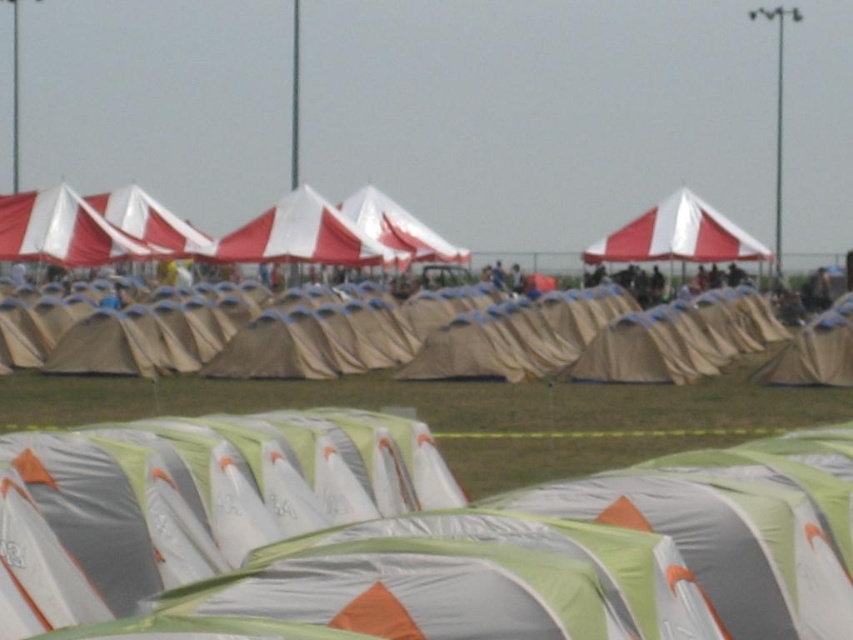
You are standing in the middle of the campsite and notice two tents in front of you. The beige canvas tent at center and the white fabric canopy at center. Which one is closer to the ground?

The beige canvas tent at center is located below the white fabric canopy at center, so it is closer to the ground.